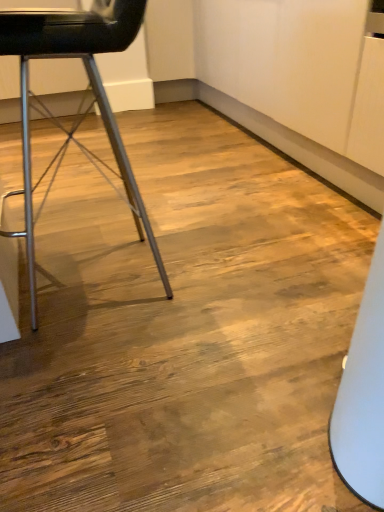
Where is `free spot in front of matte black chair at left`? This screenshot has height=512, width=384. free spot in front of matte black chair at left is located at coordinates (120, 367).